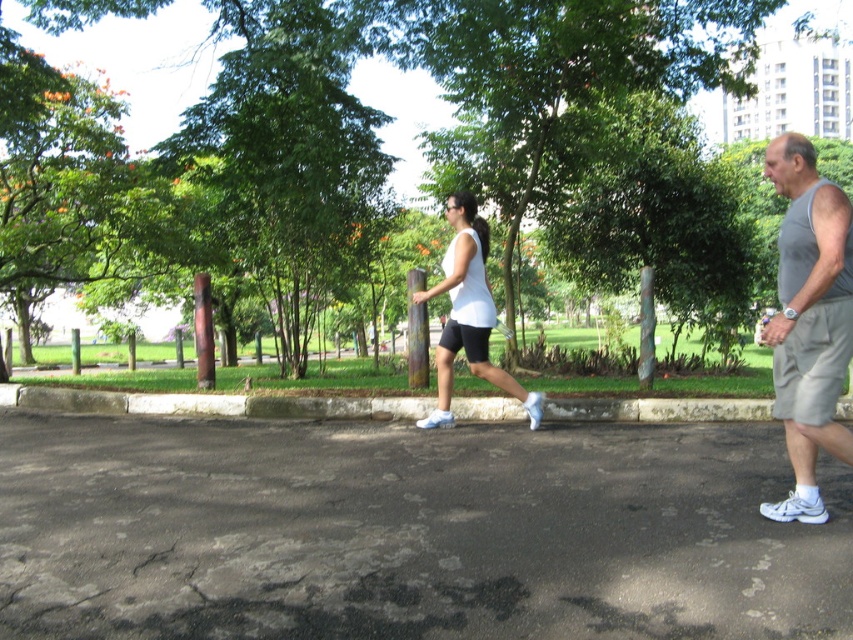
Question: Which object is positioned closest to the green leafy tree at center?

Choices:
 (A) gray fabric tank top at right
 (B) white matte shorts at center

Answer: (A)

Question: Which of the following is the farthest from the observer?

Choices:
 (A) (397, 145)
 (B) (820, 509)

Answer: (A)

Question: Which object appears closest to the camera in this image?

Choices:
 (A) green leafy tree at center
 (B) gray fabric tank top at right

Answer: (B)

Question: Is gray fabric tank top at right wider than white matte shorts at center?

Choices:
 (A) yes
 (B) no

Answer: (A)

Question: Is green leafy tree at center positioned at the back of white matte shorts at center?

Choices:
 (A) yes
 (B) no

Answer: (A)

Question: Can you confirm if gray fabric tank top at right is positioned to the right of white matte shorts at center?

Choices:
 (A) no
 (B) yes

Answer: (B)